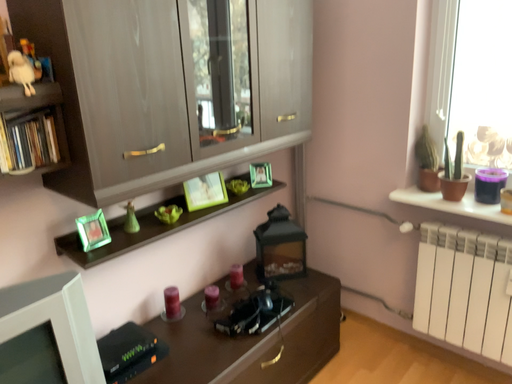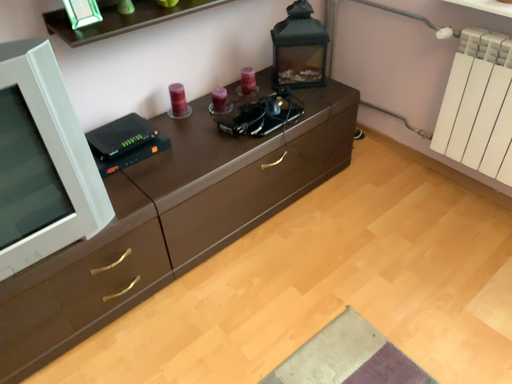
Question: Which way did the camera rotate in the video?

Choices:
 (A) rotated right
 (B) rotated left

Answer: (B)